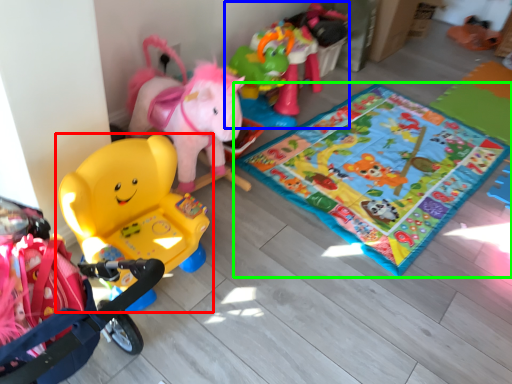
Question: Which object is the farthest from toy (highlighted by a red box)? Choose among these: toy (highlighted by a blue box) or yoga mat (highlighted by a green box).

Choices:
 (A) toy
 (B) yoga mat

Answer: (A)